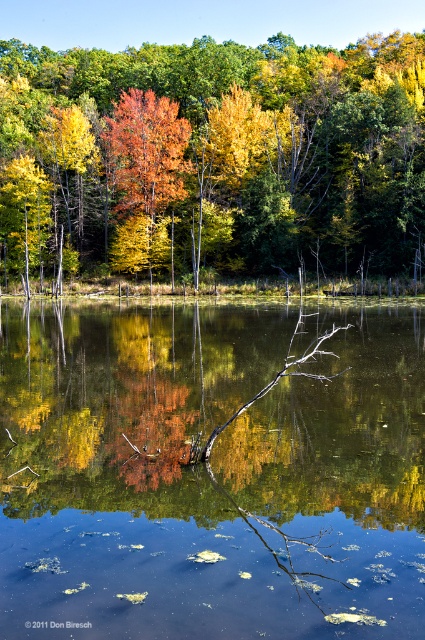
Question: Does orange leafy tree at center come behind shiny orange tree at center?

Choices:
 (A) yes
 (B) no

Answer: (B)

Question: Which object is the closest to the shiny orange tree at center?

Choices:
 (A) green reflective water at center
 (B) orange leafy tree at center

Answer: (B)

Question: Which of the following is the farthest from the observer?

Choices:
 (A) (147, 99)
 (B) (129, 116)

Answer: (A)

Question: Which object appears farthest from the camera in this image?

Choices:
 (A) orange leafy tree at center
 (B) shiny orange tree at center
 (C) green reflective water at center

Answer: (B)

Question: Does green reflective water at center have a lesser width compared to shiny orange tree at center?

Choices:
 (A) yes
 (B) no

Answer: (B)

Question: Is orange leafy tree at center positioned behind shiny orange tree at center?

Choices:
 (A) yes
 (B) no

Answer: (B)